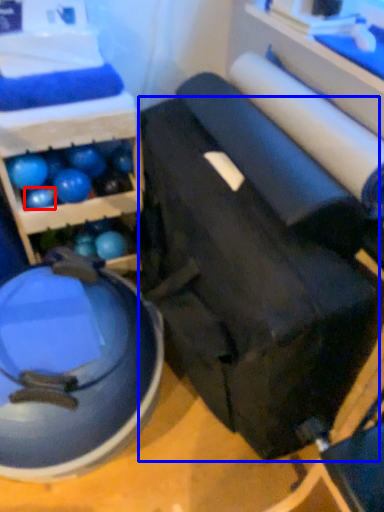
Question: Which object appears closest to the camera in this image, ball (highlighted by a red box) or swivel chair (highlighted by a blue box)?

Choices:
 (A) ball
 (B) swivel chair

Answer: (B)